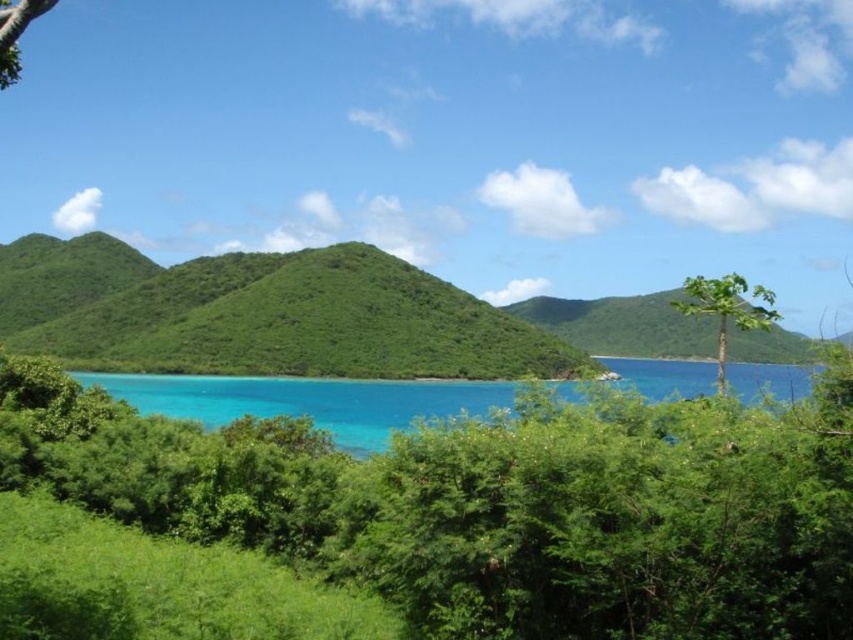
Question: Which object is closer to the camera taking this photo?

Choices:
 (A) turquoise water at center
 (B) green leafy hill at center
 (C) green leafy tree at upper left

Answer: (C)

Question: Which of the following is the farthest from the observer?

Choices:
 (A) [x=16, y=68]
 (B) [x=747, y=317]
 (C) [x=381, y=404]
 (D) [x=479, y=326]

Answer: (D)

Question: Is green leafy hill at center to the right of turquoise water at center from the viewer's perspective?

Choices:
 (A) yes
 (B) no

Answer: (B)

Question: Does green leafy hill at center appear on the left side of turquoise water at center?

Choices:
 (A) no
 (B) yes

Answer: (B)

Question: Estimate the real-world distances between objects in this image. Which object is closer to the green leafy tree at upper left?

Choices:
 (A) green leafy tree at right
 (B) green leafy hill at center
 (C) turquoise water at center

Answer: (A)

Question: Is green leafy hill at center positioned behind green leafy tree at right?

Choices:
 (A) no
 (B) yes

Answer: (B)